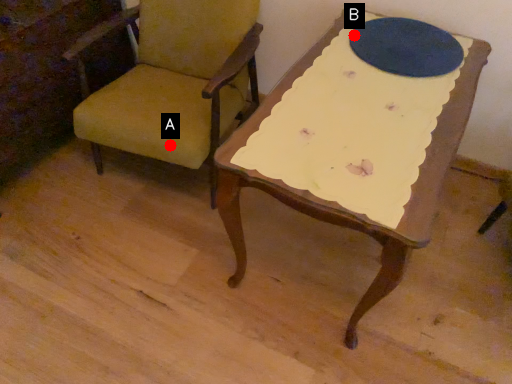
Question: Two points are circled on the image, labeled by A and B beside each circle. Which point is closer to the camera taking this photo?

Choices:
 (A) A is closer
 (B) B is closer

Answer: (A)